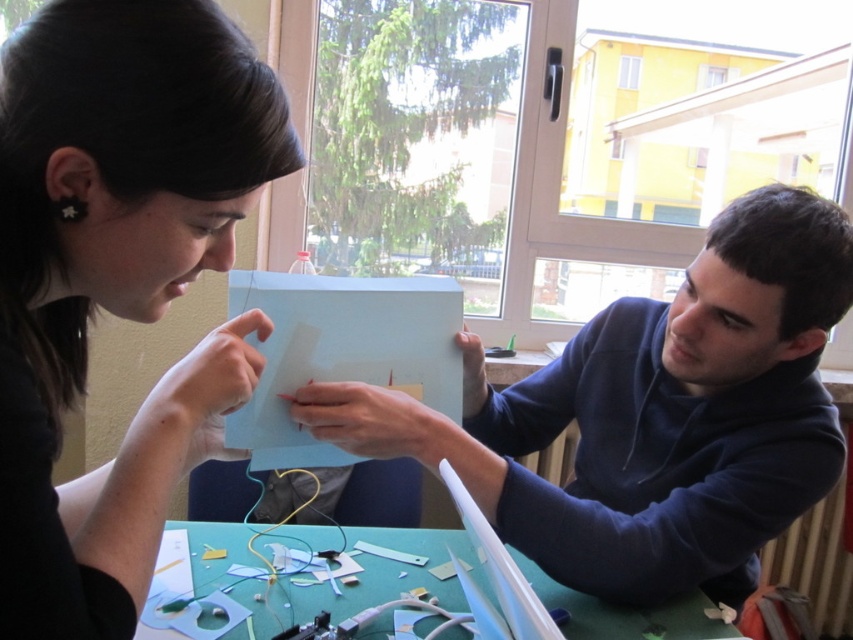
You are organizing a craft project and need to stack the matte black paper at upper left and the green paper at lower center vertically. Which paper should be placed at the bottom to ensure stability?

The matte black paper at upper left should be placed at the bottom since it is taller than the green paper at lower center, providing a stable base.

You are organizing a craft project and need to compare the sizes of two papers. You have the matte black paper at upper left and the blue matte paper at center. Which paper is shorter?

The matte black paper at upper left is shorter than the blue matte paper at center.

Looking at this image, you are standing in front of the table where the two people are working. You want to place a small sticker on the point that is closer to you. Which point should you choose between the point at coordinates point (149, 452) and the point at coordinates point (360, 410)?

You should choose point (149, 452) because it is closer to the viewer than point (360, 410) according to the description.